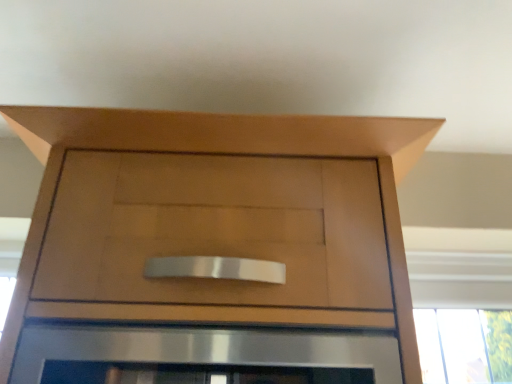
The width and height of the screenshot is (512, 384). Describe the element at coordinates (226, 153) in the screenshot. I see `matte wood cabinet at center` at that location.

This screenshot has height=384, width=512. Identify the location of matte wood cabinet at center. (226, 153).

Identify the location of matte wood cabinet at center. (226, 153).